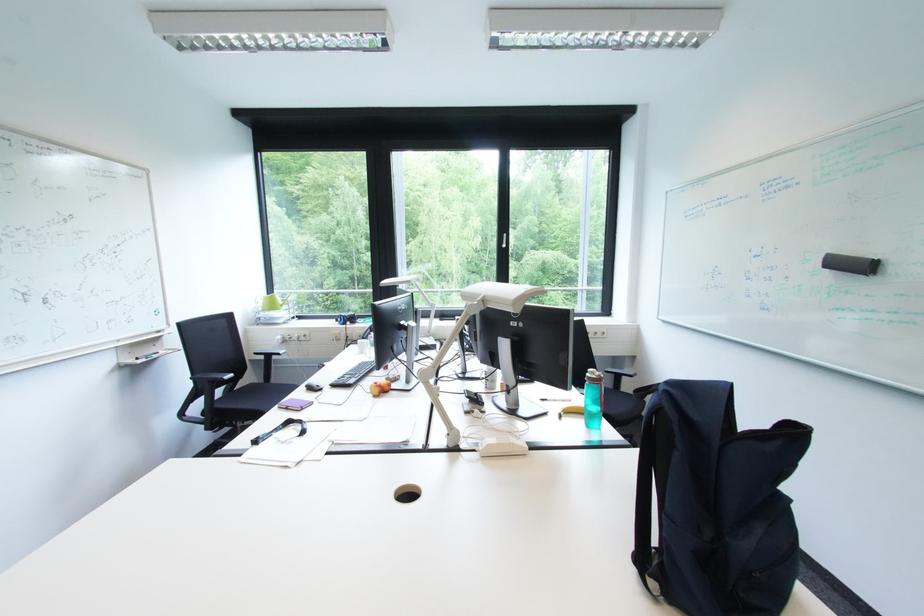
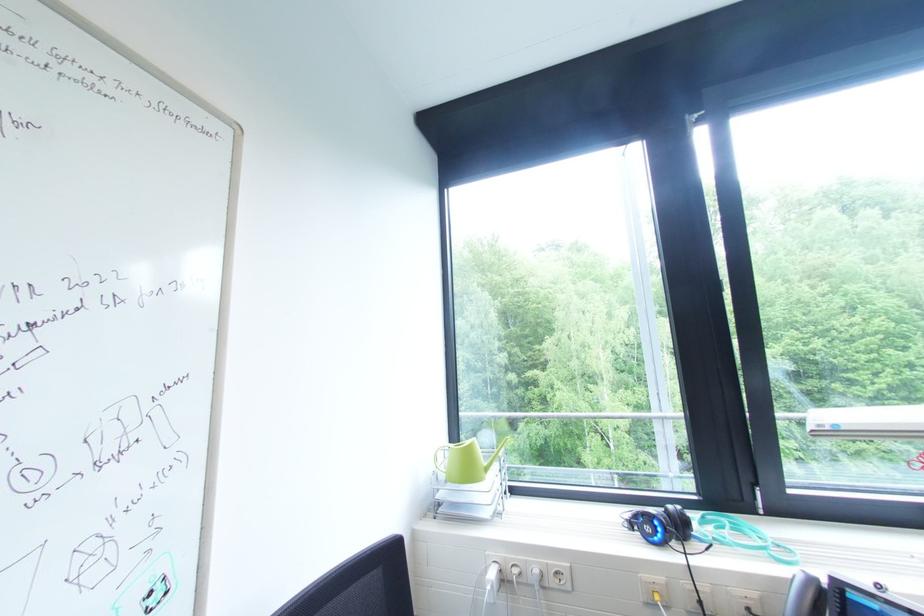
In a continuous first-person perspective shot, in which direction is the camera moving?

The cameraman moved toward left, forward.